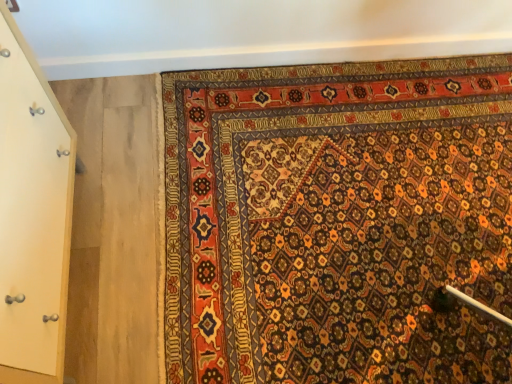
Question: Is carpet with intricate patterns at lower right closer to camera compared to light wood door at left?

Choices:
 (A) yes
 (B) no

Answer: (B)

Question: Considering the relative positions of carpet with intricate patterns at lower right and light wood door at left in the image provided, is carpet with intricate patterns at lower right behind light wood door at left?

Choices:
 (A) no
 (B) yes

Answer: (B)

Question: Is carpet with intricate patterns at lower right smaller than light wood door at left?

Choices:
 (A) yes
 (B) no

Answer: (A)

Question: From the image's perspective, is carpet with intricate patterns at lower right below light wood door at left?

Choices:
 (A) yes
 (B) no

Answer: (B)

Question: Can you confirm if carpet with intricate patterns at lower right is shorter than light wood door at left?

Choices:
 (A) no
 (B) yes

Answer: (B)

Question: Does carpet with intricate patterns at lower right appear on the left side of light wood door at left?

Choices:
 (A) no
 (B) yes

Answer: (A)

Question: Is carpet with intricate patterns at lower right at the back of light wood door at left?

Choices:
 (A) no
 (B) yes

Answer: (A)

Question: Is there a large distance between light wood door at left and carpet with intricate patterns at lower right?

Choices:
 (A) no
 (B) yes

Answer: (A)

Question: Can you confirm if light wood door at left is taller than carpet with intricate patterns at lower right?

Choices:
 (A) yes
 (B) no

Answer: (A)

Question: Is light wood door at left facing towards carpet with intricate patterns at lower right?

Choices:
 (A) no
 (B) yes

Answer: (B)

Question: Considering the relative sizes of light wood door at left and carpet with intricate patterns at lower right in the image provided, is light wood door at left bigger than carpet with intricate patterns at lower right?

Choices:
 (A) no
 (B) yes

Answer: (B)

Question: Is light wood door at left thinner than carpet with intricate patterns at lower right?

Choices:
 (A) yes
 (B) no

Answer: (A)

Question: Based on their sizes in the image, would you say light wood door at left is bigger or smaller than carpet with intricate patterns at lower right?

Choices:
 (A) small
 (B) big

Answer: (B)